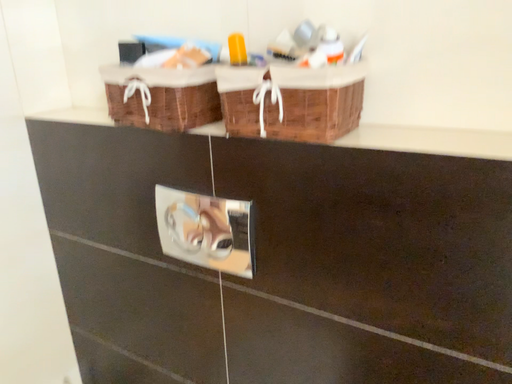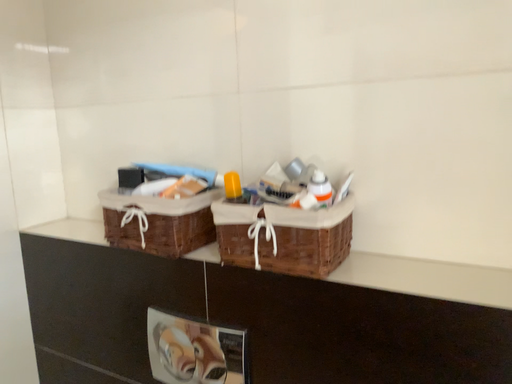
Question: How did the camera likely rotate when shooting the video?

Choices:
 (A) rotated upward
 (B) rotated downward

Answer: (A)